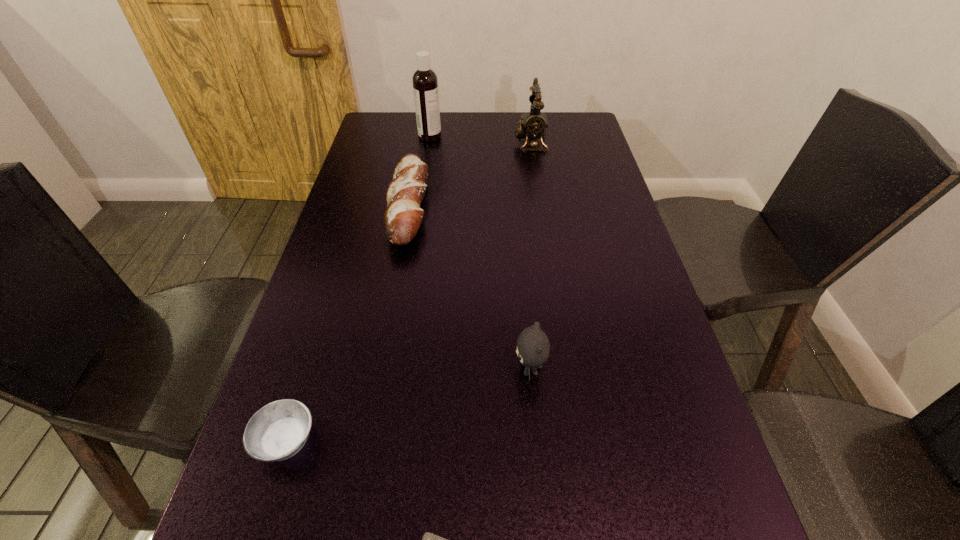
Where is `ashtray located in the left edge section of the desktop`? The image size is (960, 540). ashtray located in the left edge section of the desktop is located at coordinates (279, 430).

In order to click on vacant space at the far edge in this screenshot , I will do `click(514, 118)`.

The image size is (960, 540). Find the location of `vacant point at the left edge`. vacant point at the left edge is located at coordinates (367, 217).

In the image, there is a desktop. At what (x,y) coordinates should I click in order to perform the action: click on free region at the right edge. Please return your answer as a coordinate pair (x, y). Image resolution: width=960 pixels, height=540 pixels. Looking at the image, I should click on (621, 208).

Locate an element on the screen. This screenshot has width=960, height=540. blank area at the far left corner is located at coordinates (388, 119).

This screenshot has width=960, height=540. Identify the location of vacant space at the far right corner of the desktop. (549, 141).

Where is `free space between the ashtray and the fifth shortest object`? free space between the ashtray and the fifth shortest object is located at coordinates (408, 292).

Where is `unoccupied position between the kitten and the fifth farthest object`? unoccupied position between the kitten and the fifth farthest object is located at coordinates (408, 405).

Image resolution: width=960 pixels, height=540 pixels. I want to click on empty space between the baguet and the fourth shortest object, so click(469, 288).

At what (x,y) coordinates should I click in order to perform the action: click on free space between the fifth shortest object and the dishwasher detergent. Please return your answer as a coordinate pair (x, y). The width and height of the screenshot is (960, 540). Looking at the image, I should click on pyautogui.click(x=480, y=140).